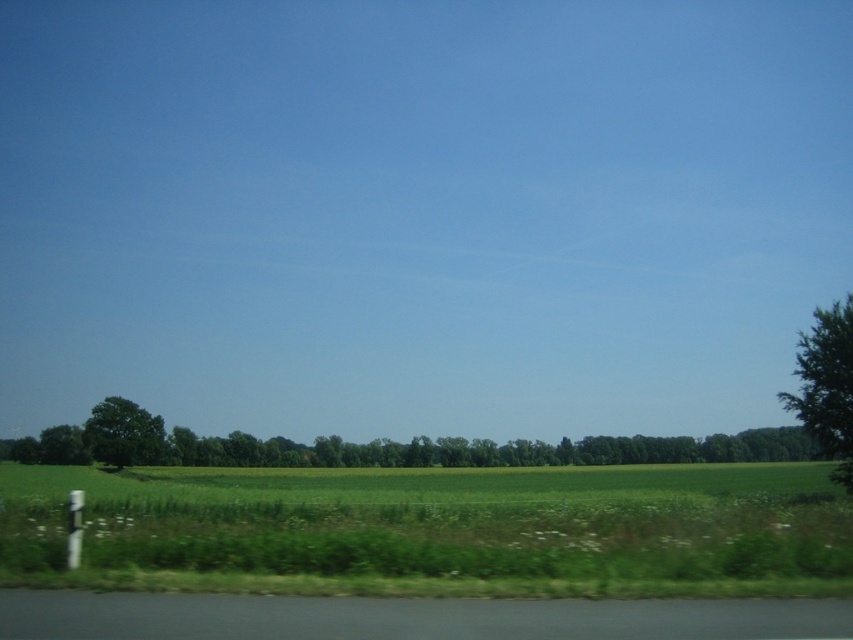
Question: Does green grass at lower center have a smaller size compared to green leafy tree at right?

Choices:
 (A) yes
 (B) no

Answer: (B)

Question: Does green grass at lower center appear on the left side of green leafy tree at lower center?

Choices:
 (A) no
 (B) yes

Answer: (B)

Question: Which object is the closest to the green grass at lower center?

Choices:
 (A) green leafy tree at lower center
 (B) green leafy tree at right

Answer: (B)

Question: Among these objects, which one is farthest from the camera?

Choices:
 (A) green grass at lower center
 (B) green leafy tree at right
 (C) green leafy tree at lower center
 (D) green leafy tree at lower left

Answer: (D)

Question: From the image, what is the correct spatial relationship of green grass at lower center in relation to green leafy tree at lower left?

Choices:
 (A) left
 (B) right

Answer: (B)

Question: Based on their relative distances, which object is farther from the green leafy tree at right?

Choices:
 (A) green leafy tree at lower left
 (B) green leafy tree at lower center

Answer: (B)